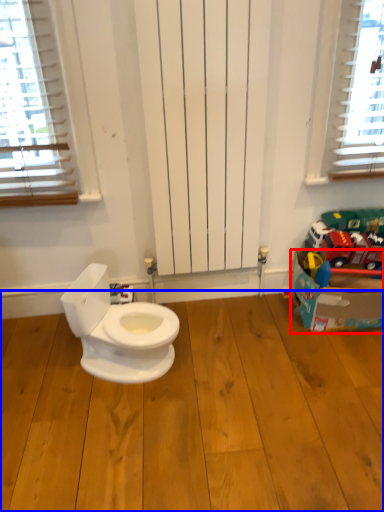
Question: Among these objects, which one is farthest to the camera, cardboard box (highlighted by a red box) or hardwood (highlighted by a blue box)?

Choices:
 (A) cardboard box
 (B) hardwood

Answer: (A)